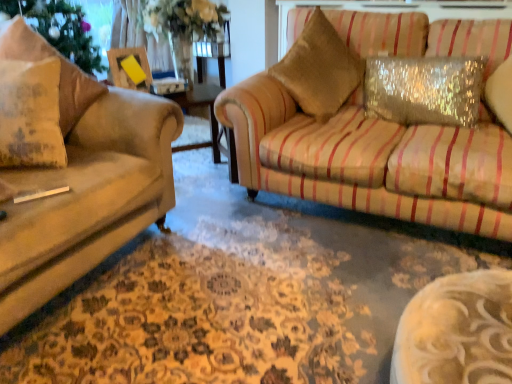
Question: Does sparkly silver pillow at upper right, which is the first pillow in right-to-left order, turn towards textured beige pillow at left, the 2th pillow positioned from the left?

Choices:
 (A) yes
 (B) no

Answer: (B)

Question: From a real-world perspective, is sparkly silver pillow at upper right, placed as the 3th pillow when sorted from left to right, positioned over textured beige pillow at left, the 2th pillow positioned from the left, based on gravity?

Choices:
 (A) no
 (B) yes

Answer: (A)

Question: Is sparkly silver pillow at upper right, placed as the 3th pillow when sorted from left to right, positioned in front of textured beige pillow at left, which is the second pillow in right-to-left order?

Choices:
 (A) yes
 (B) no

Answer: (B)

Question: Does sparkly silver pillow at upper right, placed as the 3th pillow when sorted from left to right, have a lesser height compared to textured beige pillow at left, the 2th pillow positioned from the left?

Choices:
 (A) no
 (B) yes

Answer: (B)

Question: Considering the relative sizes of sparkly silver pillow at upper right, placed as the 3th pillow when sorted from left to right, and textured beige pillow at left, the 2th pillow positioned from the left, in the image provided, is sparkly silver pillow at upper right, placed as the 3th pillow when sorted from left to right, taller than textured beige pillow at left, the 2th pillow positioned from the left,?

Choices:
 (A) yes
 (B) no

Answer: (B)

Question: In terms of height, does gold textured pillow at upper right look taller or shorter compared to matte beige pillow at left, the 1th pillow viewed from the left?

Choices:
 (A) tall
 (B) short

Answer: (A)

Question: Choose the correct answer: Is gold textured pillow at upper right inside matte beige pillow at left, the 1th pillow viewed from the left, or outside it?

Choices:
 (A) outside
 (B) inside

Answer: (A)

Question: Is point (286, 74) closer or farther from the camera than point (47, 122)?

Choices:
 (A) farther
 (B) closer

Answer: (A)

Question: From a real-world perspective, is gold textured pillow at upper right above or below matte beige pillow at left, the third pillow in the right-to-left sequence?

Choices:
 (A) above
 (B) below

Answer: (A)

Question: Is matte beige pillow at left, the third pillow in the right-to-left sequence, bigger or smaller than gold textured pillow at upper right?

Choices:
 (A) big
 (B) small

Answer: (B)

Question: Which is correct: matte beige pillow at left, the third pillow in the right-to-left sequence, is inside gold textured pillow at upper right, or outside of it?

Choices:
 (A) outside
 (B) inside

Answer: (A)

Question: Considering their positions, is matte beige pillow at left, the third pillow in the right-to-left sequence, located in front of or behind gold textured pillow at upper right?

Choices:
 (A) behind
 (B) front

Answer: (B)

Question: From a real-world perspective, relative to gold textured pillow at upper right, is matte beige pillow at left, the 1th pillow viewed from the left, vertically above or below?

Choices:
 (A) below
 (B) above

Answer: (A)

Question: In terms of height, does textured beige pillow at left, which is the second pillow in right-to-left order, look taller or shorter compared to matte beige pillow at left, the 1th pillow viewed from the left?

Choices:
 (A) short
 (B) tall

Answer: (B)

Question: From the image's perspective, is textured beige pillow at left, the 2th pillow positioned from the left, above or below matte beige pillow at left, the 1th pillow viewed from the left?

Choices:
 (A) above
 (B) below

Answer: (A)